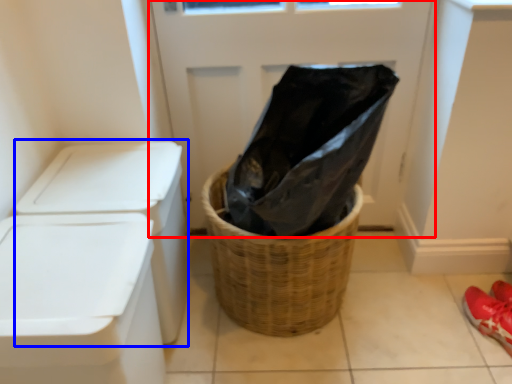
Question: Which of the following is the closest to the observer, screen door (highlighted by a red box) or washer (highlighted by a blue box)?

Choices:
 (A) screen door
 (B) washer

Answer: (B)